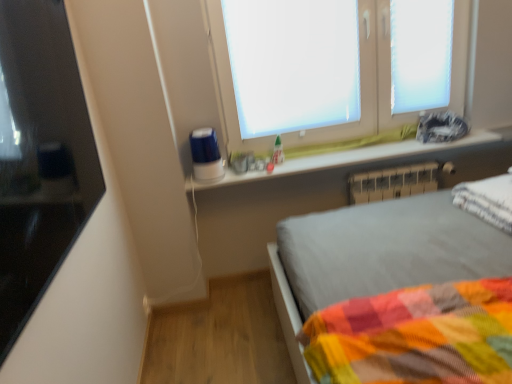
Question: Is white soft pillow at right completely or partially outside of black glossy monitor at left?

Choices:
 (A) yes
 (B) no

Answer: (A)

Question: Is white soft pillow at right shorter than black glossy monitor at left?

Choices:
 (A) no
 (B) yes

Answer: (B)

Question: Is white soft pillow at right oriented towards black glossy monitor at left?

Choices:
 (A) yes
 (B) no

Answer: (B)

Question: Could black glossy monitor at left be considered to be inside white soft pillow at right?

Choices:
 (A) no
 (B) yes

Answer: (A)

Question: Is white soft pillow at right behind black glossy monitor at left?

Choices:
 (A) yes
 (B) no

Answer: (A)

Question: Do you think white glossy window sill at upper center is within white plastic window frame at upper right, or outside of it?

Choices:
 (A) inside
 (B) outside

Answer: (B)

Question: Is point (365, 157) closer or farther from the camera than point (408, 69)?

Choices:
 (A) closer
 (B) farther

Answer: (A)

Question: From their relative heights in the image, would you say white glossy window sill at upper center is taller or shorter than white plastic window frame at upper right?

Choices:
 (A) short
 (B) tall

Answer: (A)

Question: In terms of width, does white glossy window sill at upper center look wider or thinner when compared to white plastic window frame at upper right?

Choices:
 (A) wide
 (B) thin

Answer: (A)

Question: Based on their sizes in the image, would you say white plastic radiator at lower right is bigger or smaller than white soft pillow at right?

Choices:
 (A) big
 (B) small

Answer: (B)

Question: Would you say white plastic radiator at lower right is to the left or to the right of white soft pillow at right in the picture?

Choices:
 (A) right
 (B) left

Answer: (B)

Question: Considering the positions of white plastic radiator at lower right and white soft pillow at right in the image, is white plastic radiator at lower right taller or shorter than white soft pillow at right?

Choices:
 (A) tall
 (B) short

Answer: (A)

Question: From the image's perspective, relative to white soft pillow at right, is white plastic radiator at lower right above or below?

Choices:
 (A) below
 (B) above

Answer: (B)

Question: In the image, is white plastic radiator at lower right on the left side or the right side of white matte window screen at upper center?

Choices:
 (A) right
 (B) left

Answer: (A)

Question: Is point (428, 170) closer or farther from the camera than point (240, 16)?

Choices:
 (A) closer
 (B) farther

Answer: (B)